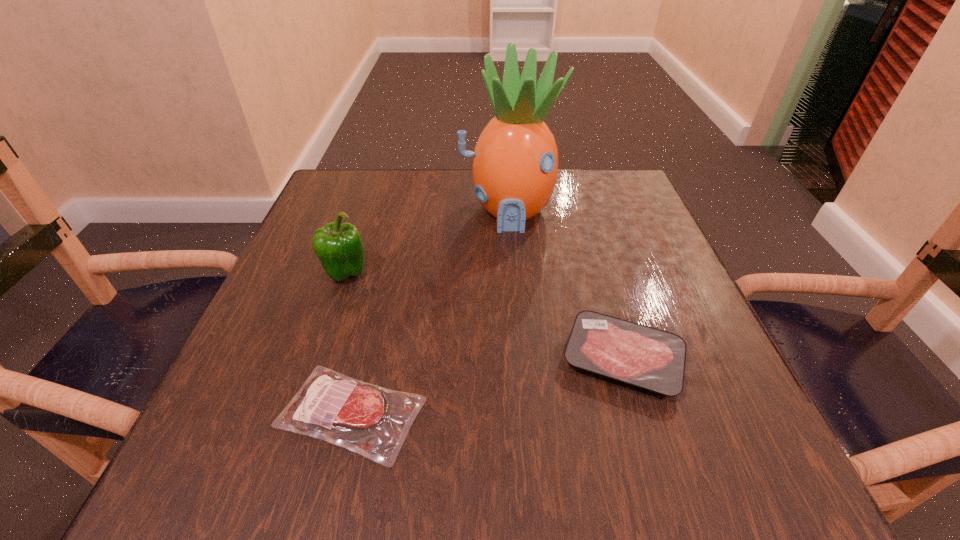
At what (x,y) coordinates should I click in order to perform the action: click on blank area at the near left corner. Please return your answer as a coordinate pair (x, y). Looking at the image, I should click on (294, 436).

Identify the location of blank space at the near right corner of the desktop. This screenshot has width=960, height=540. (771, 447).

You are a GUI agent. You are given a task and a screenshot of the screen. Output one action in this format:
    pyautogui.click(x=<x>, y=<y>)
    Task: Click on the vacant point located between the bell pepper and the right steak
    Image resolution: width=960 pixels, height=540 pixels.
    Given the screenshot: What is the action you would take?
    pyautogui.click(x=485, y=316)

Locate an element on the screen. The height and width of the screenshot is (540, 960). blank region between the right steak and the second tallest object is located at coordinates (485, 316).

Image resolution: width=960 pixels, height=540 pixels. What are the coordinates of `vacant area that lies between the left steak and the right steak` in the screenshot? It's located at (487, 386).

The height and width of the screenshot is (540, 960). Find the location of `vacant space that's between the right steak and the bell pepper`. vacant space that's between the right steak and the bell pepper is located at coordinates (485, 316).

You are a GUI agent. You are given a task and a screenshot of the screen. Output one action in this format:
    pyautogui.click(x=<x>, y=<y>)
    Task: Click on the free space between the right steak and the left steak
    The height and width of the screenshot is (540, 960).
    Given the screenshot: What is the action you would take?
    pyautogui.click(x=487, y=386)

Locate an element on the screen. The height and width of the screenshot is (540, 960). free area in between the farthest object and the left steak is located at coordinates (429, 312).

Identify the location of free space that is in between the left steak and the third shortest object. (348, 343).

You are a GUI agent. You are given a task and a screenshot of the screen. Output one action in this format:
    pyautogui.click(x=<x>, y=<y>)
    Task: Click on the free spot between the right steak and the left steak
    Image resolution: width=960 pixels, height=540 pixels.
    Given the screenshot: What is the action you would take?
    pos(487,386)